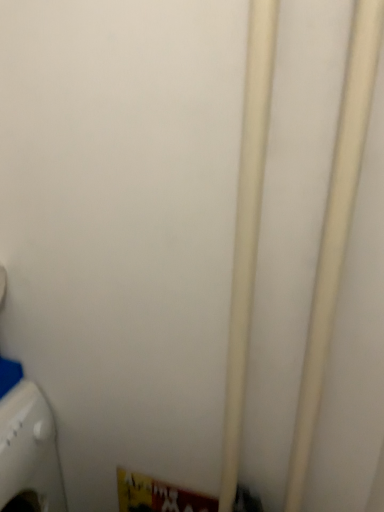
Question: Does white matte pipe at center, which is the second pipe in left-to-right order, have a greater height compared to white matte pipe at center, the first pipe positioned from the left?

Choices:
 (A) no
 (B) yes

Answer: (A)

Question: Is white matte pipe at center, arranged as the 1th pipe when viewed from the right, completely or partially outside of white matte pipe at center, the 2th pipe viewed from the right?

Choices:
 (A) no
 (B) yes

Answer: (B)

Question: Is white matte pipe at center, arranged as the 1th pipe when viewed from the right, at the right side of white matte pipe at center, the first pipe positioned from the left?

Choices:
 (A) no
 (B) yes

Answer: (B)

Question: Considering the relative sizes of white matte pipe at center, which is the second pipe in left-to-right order, and white matte pipe at center, the 2th pipe viewed from the right, in the image provided, is white matte pipe at center, which is the second pipe in left-to-right order, shorter than white matte pipe at center, the 2th pipe viewed from the right,?

Choices:
 (A) yes
 (B) no

Answer: (A)

Question: Is white matte pipe at center, arranged as the 1th pipe when viewed from the right, aimed at white matte pipe at center, the 2th pipe viewed from the right?

Choices:
 (A) yes
 (B) no

Answer: (B)

Question: In the image, is white matte pipe at center, which is the second pipe in left-to-right order, on the left side or the right side of white matte pipe at center, the first pipe positioned from the left?

Choices:
 (A) right
 (B) left

Answer: (A)

Question: Is white matte pipe at center, which is the second pipe in left-to-right order, wider or thinner than white matte pipe at center, the 2th pipe viewed from the right?

Choices:
 (A) thin
 (B) wide

Answer: (A)

Question: From the image's perspective, is white matte pipe at center, which is the second pipe in left-to-right order, located above or below white matte pipe at center, the first pipe positioned from the left?

Choices:
 (A) below
 (B) above

Answer: (B)

Question: From a real-world perspective, is white matte pipe at center, arranged as the 1th pipe when viewed from the right, positioned above or below white matte pipe at center, the first pipe positioned from the left?

Choices:
 (A) below
 (B) above

Answer: (B)

Question: From the image's perspective, is white matte pipe at center, arranged as the 1th pipe when viewed from the right, above or below white plastic washing machine at lower left?

Choices:
 (A) above
 (B) below

Answer: (A)

Question: Based on their positions, is white matte pipe at center, which is the second pipe in left-to-right order, located to the left or right of white plastic washing machine at lower left?

Choices:
 (A) left
 (B) right

Answer: (B)

Question: Considering the positions of white matte pipe at center, which is the second pipe in left-to-right order, and white plastic washing machine at lower left in the image, is white matte pipe at center, which is the second pipe in left-to-right order, taller or shorter than white plastic washing machine at lower left?

Choices:
 (A) short
 (B) tall

Answer: (B)

Question: Is point (331, 200) positioned closer to the camera than point (36, 418)?

Choices:
 (A) farther
 (B) closer

Answer: (B)

Question: Considering the positions of point [x=248, y=271] and point [x=51, y=509], is point [x=248, y=271] closer or farther from the camera than point [x=51, y=509]?

Choices:
 (A) farther
 (B) closer

Answer: (B)

Question: Considering the positions of white matte pipe at center, the 2th pipe viewed from the right, and white plastic washing machine at lower left in the image, is white matte pipe at center, the 2th pipe viewed from the right, wider or thinner than white plastic washing machine at lower left?

Choices:
 (A) wide
 (B) thin

Answer: (B)